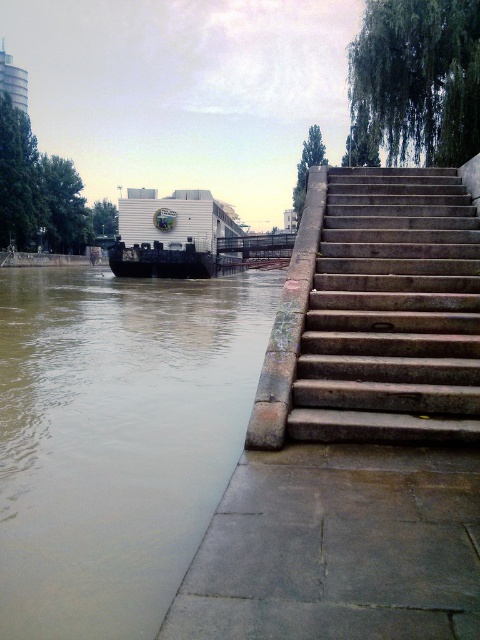
Question: Which point is farther from the camera taking this photo?

Choices:
 (A) (406, 317)
 (B) (97, 352)

Answer: (B)

Question: Which object is closer to the camera taking this photo?

Choices:
 (A) brown concrete river at lower left
 (B) white matte barge at center-left

Answer: (A)

Question: Can you confirm if brown concrete river at lower left is positioned to the right of white matte barge at center-left?

Choices:
 (A) no
 (B) yes

Answer: (B)

Question: Which point is closer to the camera?

Choices:
 (A) brown concrete river at lower left
 (B) white matte barge at center-left
 (C) stone steps at right

Answer: (A)

Question: Can you confirm if brown concrete river at lower left is positioned above stone steps at right?

Choices:
 (A) no
 (B) yes

Answer: (B)

Question: Observing the image, what is the correct spatial positioning of brown concrete river at lower left in reference to white matte barge at center-left?

Choices:
 (A) above
 (B) below

Answer: (B)